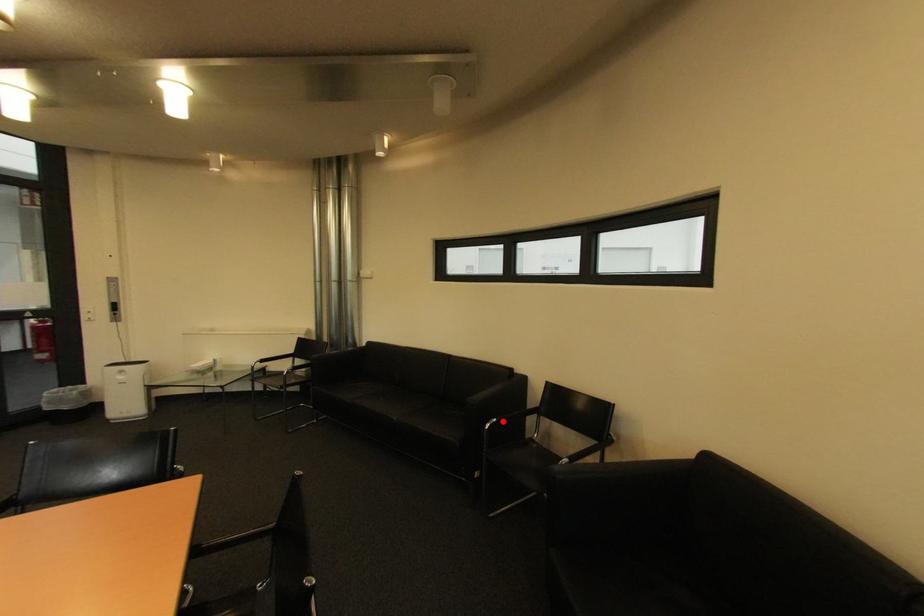
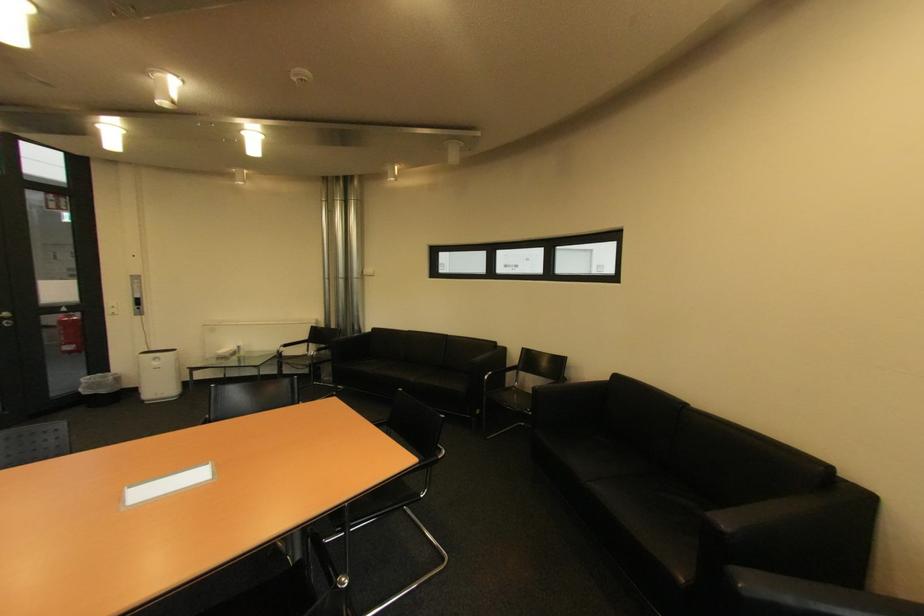
The point at the highlighted location is marked in the first image. Where is the corresponding point in the second image?

(499, 374)